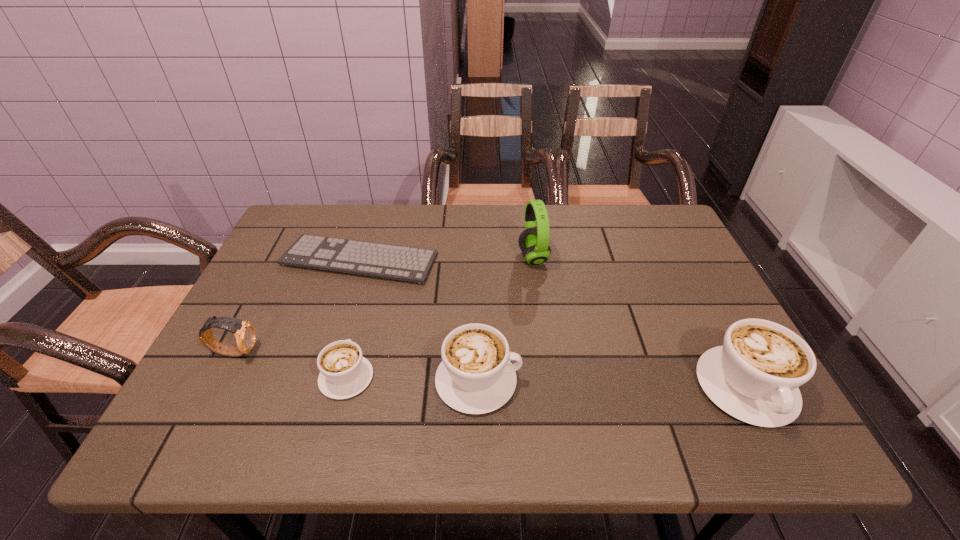
What are the coordinates of `free space located to the right of the leftmost cappuccino's handle` in the screenshot? It's located at (361, 321).

Where is `free space located to the right of the leftmost cappuccino's handle`? The width and height of the screenshot is (960, 540). free space located to the right of the leftmost cappuccino's handle is located at coordinates [365, 309].

Locate an element on the screen. The width and height of the screenshot is (960, 540). vacant region located 0.200m to the right of the second cappuccino from left to right's handle is located at coordinates (614, 380).

Image resolution: width=960 pixels, height=540 pixels. In order to click on vacant area situated on the face of the watch in this screenshot , I will do `click(387, 352)`.

Find the location of `vacant space located 0.140m on the front of the headset`. vacant space located 0.140m on the front of the headset is located at coordinates (540, 312).

Identify the location of vacant position located on the right of the shortest object. The height and width of the screenshot is (540, 960). [x=544, y=260].

I want to click on headset that is at the far edge, so click(533, 242).

This screenshot has height=540, width=960. Identify the location of computer keyboard located in the far edge section of the desktop. click(403, 263).

Where is `watch located in the left edge section of the desktop`? The width and height of the screenshot is (960, 540). watch located in the left edge section of the desktop is located at coordinates (245, 333).

Where is `computer keyboard that is at the left edge`? The height and width of the screenshot is (540, 960). computer keyboard that is at the left edge is located at coordinates (403, 263).